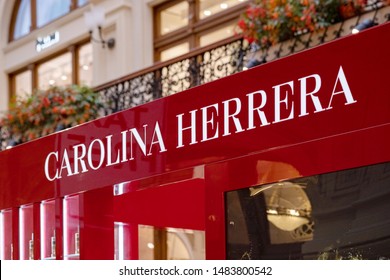
Identify the location of beige windows. (173, 20), (172, 48), (213, 6), (212, 36).